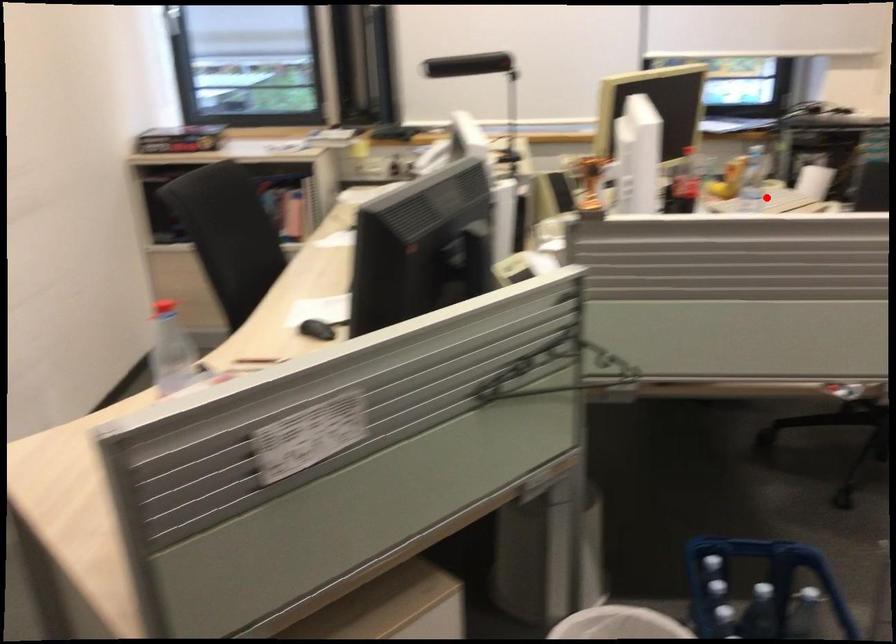
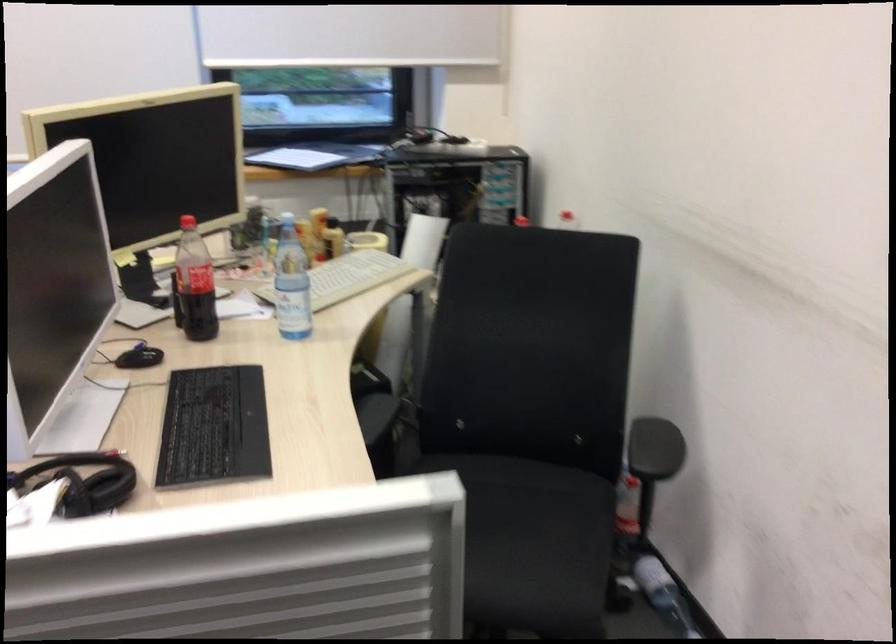
In the second image, find the point that corresponds to the highlighted location in the first image.

(347, 277)